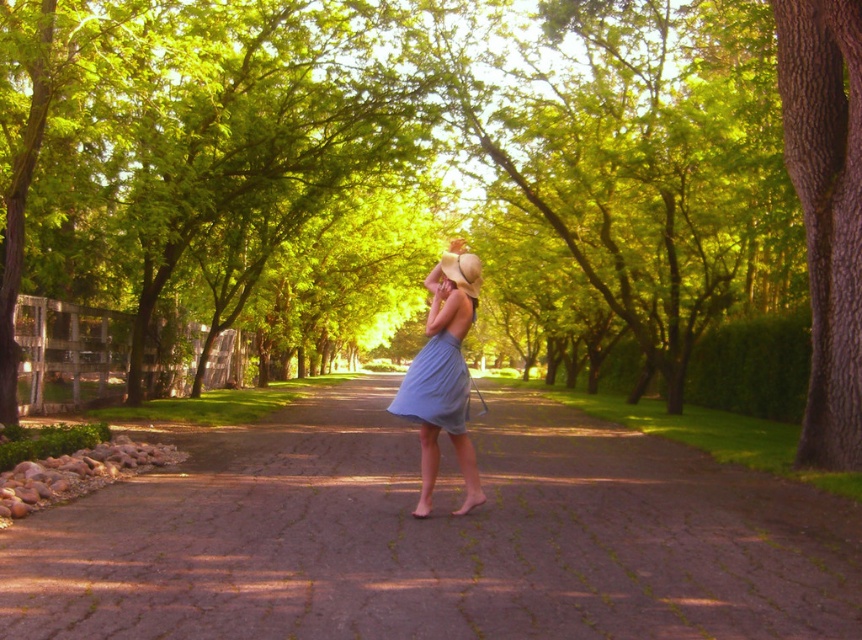
Question: Does green leafy tree at center appear on the left side of paved stone path at center?

Choices:
 (A) yes
 (B) no

Answer: (B)

Question: Can you confirm if green leafy tree at center is wider than brown rough bark tree at right?

Choices:
 (A) yes
 (B) no

Answer: (A)

Question: Which point is closer to the camera?

Choices:
 (A) (186, 579)
 (B) (834, 305)
 (C) (838, 100)
 (D) (410, 364)

Answer: (A)

Question: Which point is farther to the camera?

Choices:
 (A) brown rough bark tree at right
 (B) light blue fabric dress at center
 (C) green leafy tree at center

Answer: (C)

Question: Is green leafy tree at center smaller than paved stone path at center?

Choices:
 (A) yes
 (B) no

Answer: (B)

Question: Which of the following is the farthest from the observer?

Choices:
 (A) green leafy tree at center
 (B) light blue fabric dress at center

Answer: (A)